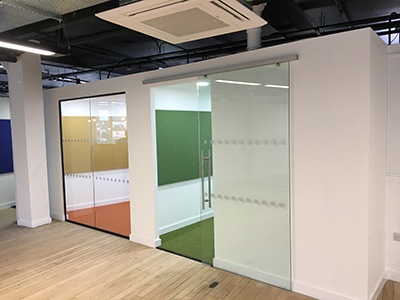
Identify the location of ceiling. (x=335, y=16).